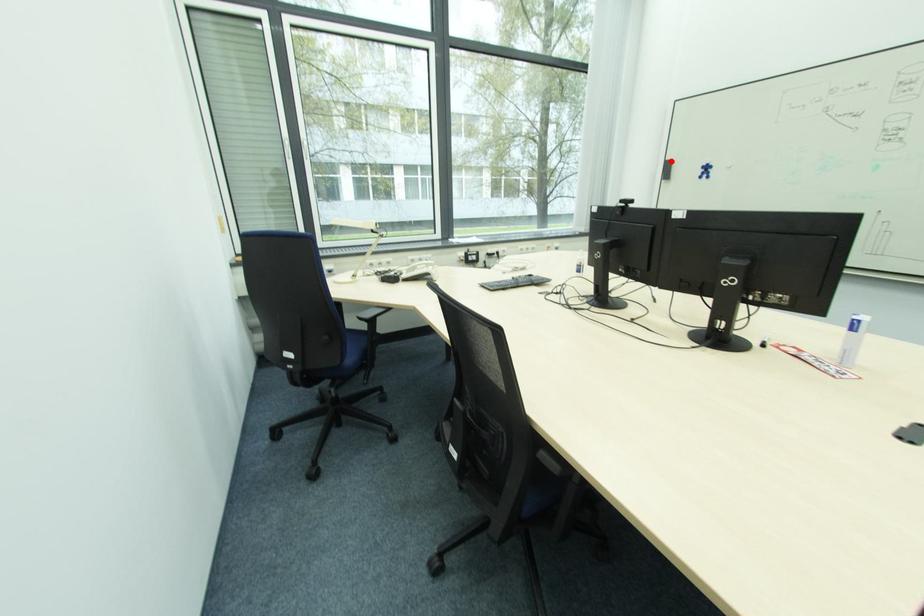
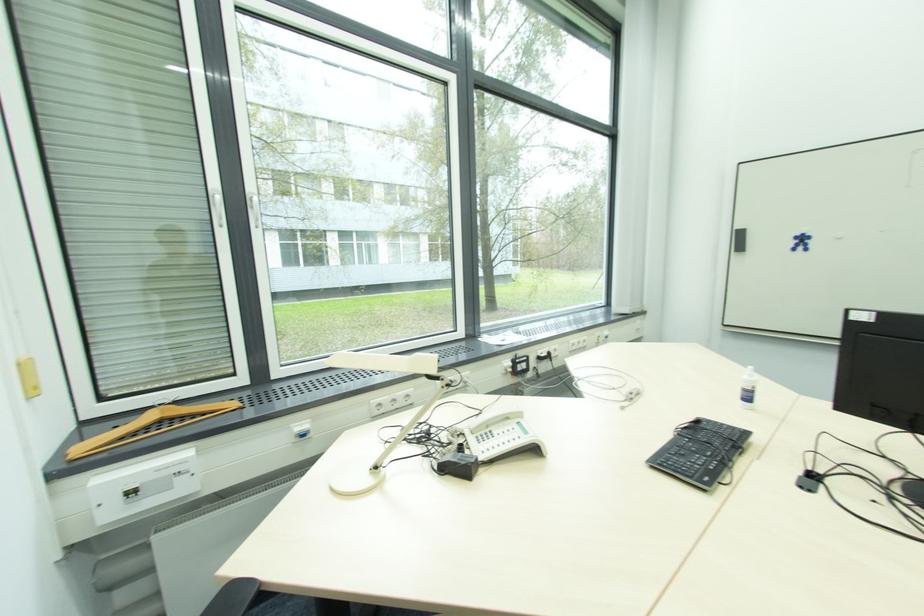
The point at the highlighted location is marked in the first image. Where is the corresponding point in the second image?

(739, 230)